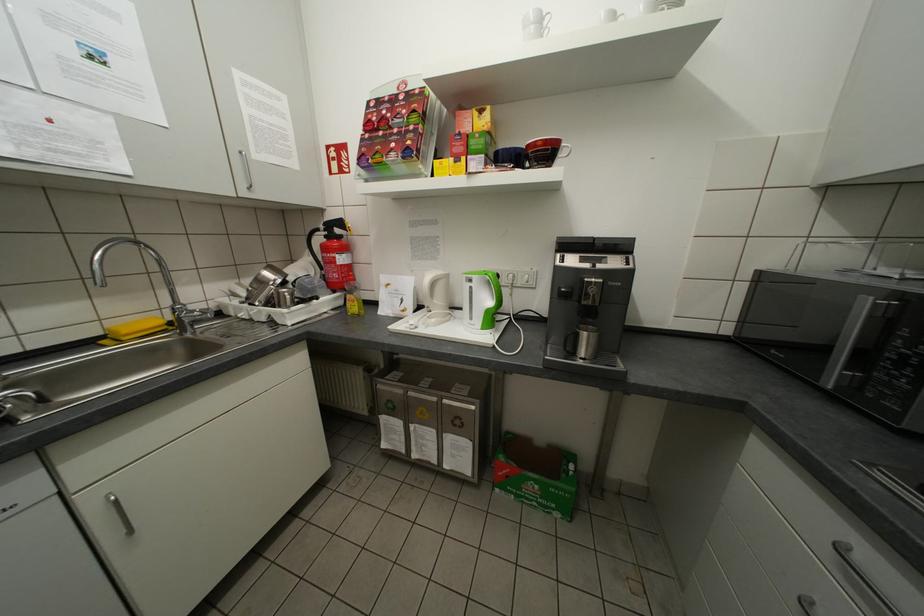
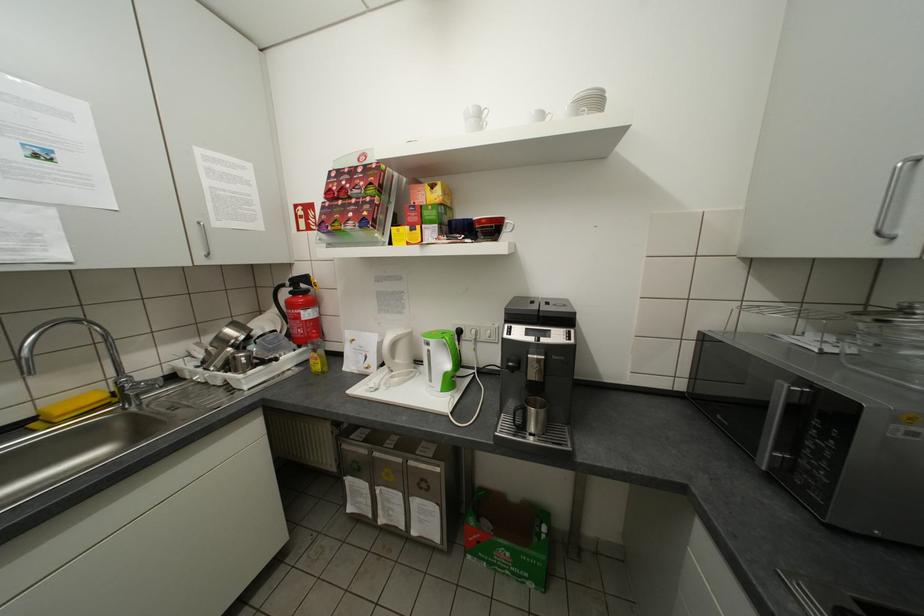
The point at (479, 476) is marked in the first image. Where is the corresponding point in the second image?

(448, 543)